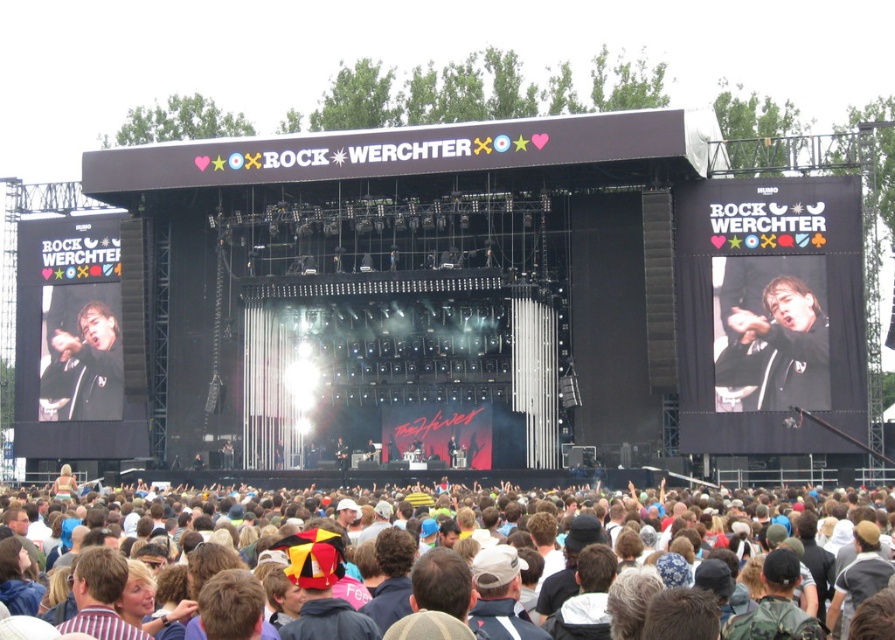
You are a photographer at the Rock Werchter festival. You need to capture a photo of the dark brown hair at lower center and the black matte jacket at upper right. Which object should you focus on first if you want to ensure both are in sharp focus?

The dark brown hair at lower center is shorter than the black matte jacket at upper right. To ensure both are in sharp focus, you should focus on the black matte jacket at upper right since it is farther away, allowing the depth of field to cover the closer dark brown hair at lower center.

You are a photographer at the Rock Werchter festival. You want to capture a photo that includes both the dark brown hair at lower center and the black matte jacket at upper right. Which object should you focus on first to ensure both are in frame?

You should focus on the dark brown hair at lower center first because it is larger in size than the black matte jacket at upper right, making it easier to position within the frame while still including the smaller object.

You are standing at the center of the stage at Rock Werchter festival. You see a point marked at coordinates [774,348]. According to the image, where is this point located?

The point at [774,348] is located on the black matte jacket at upper right.